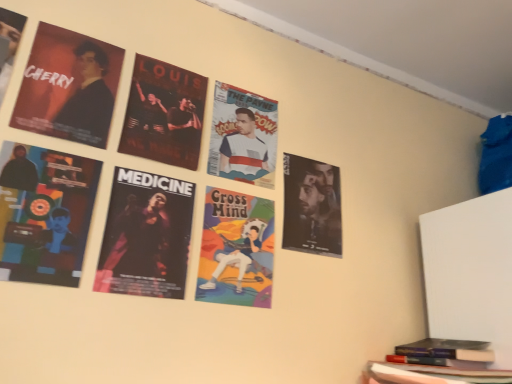
Question: Does matte black poster at lower left, the 5th poster in the right-to-left sequence, have a smaller size compared to matte black poster at upper left, the 1th poster in the left-to-right sequence?

Choices:
 (A) no
 (B) yes

Answer: (B)

Question: From a real-world perspective, is matte black poster at lower left, the second poster from the left, beneath matte black poster at upper left, the 1th poster in the left-to-right sequence?

Choices:
 (A) yes
 (B) no

Answer: (A)

Question: Is matte black poster at lower left, the 5th poster in the right-to-left sequence, positioned with its back to matte black poster at upper left, the sixth poster when ordered from right to left?

Choices:
 (A) yes
 (B) no

Answer: (B)

Question: From a real-world perspective, is matte black poster at lower left, the second poster from the left, located higher than matte black poster at upper left, the sixth poster when ordered from right to left?

Choices:
 (A) no
 (B) yes

Answer: (A)

Question: Is matte black poster at lower left, the second poster from the left, at the right side of matte black poster at upper left, the 1th poster in the left-to-right sequence?

Choices:
 (A) no
 (B) yes

Answer: (B)

Question: Considering their positions, is matte black poster at lower left, the 5th poster in the right-to-left sequence, located in front of or behind matte black poster at right, the 1th poster when ordered from right to left?

Choices:
 (A) behind
 (B) front

Answer: (B)

Question: Would you say matte black poster at lower left, the 5th poster in the right-to-left sequence, is to the left or to the right of matte black poster at right, the 1th poster when ordered from right to left, in the picture?

Choices:
 (A) left
 (B) right

Answer: (A)

Question: Does point (81, 236) appear closer or farther from the camera than point (290, 173)?

Choices:
 (A) farther
 (B) closer

Answer: (B)

Question: From a real-world perspective, is matte black poster at lower left, the second poster from the left, physically located above or below matte black poster at right, the 1th poster when ordered from right to left?

Choices:
 (A) above
 (B) below

Answer: (B)

Question: In terms of size, does dark matte poster at center-left, which ranks as the fourth poster in left-to-right order, appear bigger or smaller than matte black poster at upper left, the sixth poster when ordered from right to left?

Choices:
 (A) small
 (B) big

Answer: (A)

Question: Is dark matte poster at center-left, marked as the third poster in a right-to-left arrangement, inside or outside of matte black poster at upper left, the sixth poster when ordered from right to left?

Choices:
 (A) inside
 (B) outside

Answer: (B)

Question: From a real-world perspective, is dark matte poster at center-left, which ranks as the fourth poster in left-to-right order, physically located above or below matte black poster at upper left, the sixth poster when ordered from right to left?

Choices:
 (A) above
 (B) below

Answer: (B)

Question: Relative to matte black poster at upper left, the sixth poster when ordered from right to left, is dark matte poster at center-left, marked as the third poster in a right-to-left arrangement, in front or behind?

Choices:
 (A) behind
 (B) front

Answer: (A)

Question: In terms of width, does matte black poster at upper left, which ranks as the 4th poster in right-to-left order, look wider or thinner when compared to dark matte poster at center-left, marked as the third poster in a right-to-left arrangement?

Choices:
 (A) wide
 (B) thin

Answer: (A)

Question: Considering the positions of matte black poster at upper left, which ranks as the 4th poster in right-to-left order, and dark matte poster at center-left, which ranks as the fourth poster in left-to-right order, in the image, is matte black poster at upper left, which ranks as the 4th poster in right-to-left order, taller or shorter than dark matte poster at center-left, which ranks as the fourth poster in left-to-right order,?

Choices:
 (A) tall
 (B) short

Answer: (B)